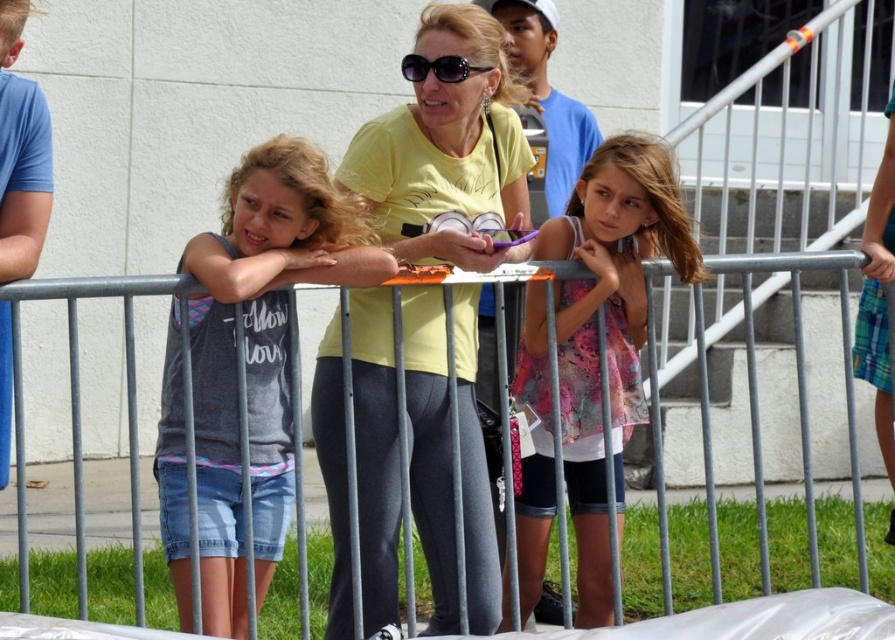
Can you confirm if metallic gray fence at center is bigger than printed fabric dress at center?

Incorrect, metallic gray fence at center is not larger than printed fabric dress at center.

Is point (351, 621) positioned behind point (662, 216)?

No.

Does point (831, 253) come farther from viewer compared to point (540, 308)?

That is True.

You are a GUI agent. You are given a task and a screenshot of the screen. Output one action in this format:
    pyautogui.click(x=<x>, y=<y>)
    Task: Click on the metallic gray fence at center
    The width and height of the screenshot is (895, 640).
    Given the screenshot: What is the action you would take?
    pyautogui.click(x=799, y=394)

From the picture: Can you confirm if yellow matte t-shirt at center is positioned above denim shorts at center?

Correct, yellow matte t-shirt at center is located above denim shorts at center.

Does yellow matte t-shirt at center have a greater height compared to denim shorts at center?

Indeed, yellow matte t-shirt at center has a greater height compared to denim shorts at center.

Is point (471, 598) positioned behind point (205, 516)?

Yes, point (471, 598) is behind point (205, 516).

Find the location of a particular element. yellow matte t-shirt at center is located at coordinates (448, 154).

Does denim shorts at center have a greater height compared to metallic gray fence at center?

Yes, denim shorts at center is taller than metallic gray fence at center.

Who is shorter, denim shorts at center or metallic gray fence at center?

Standing shorter between the two is metallic gray fence at center.

What are the coordinates of `denim shorts at center` in the screenshot? It's located at (260, 353).

Find the location of a particular element. The image size is (895, 640). denim shorts at center is located at coordinates 260,353.